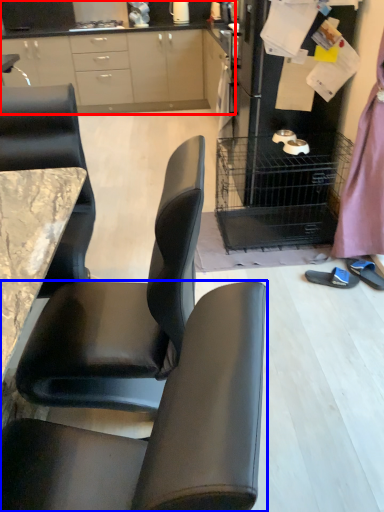
Question: Which of the following is the farthest to the observer, cabinetry (highlighted by a red box) or chair (highlighted by a blue box)?

Choices:
 (A) cabinetry
 (B) chair

Answer: (A)